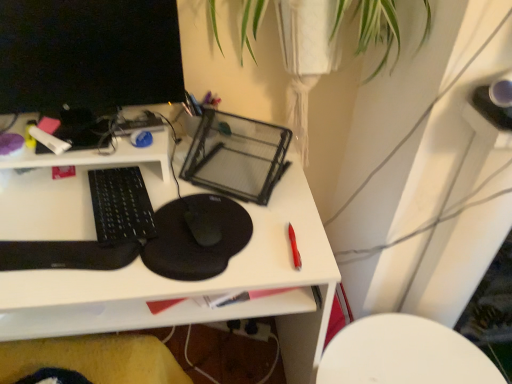
Question: Is black matte mouse at center wider or thinner than black matte mousepad at center?

Choices:
 (A) thin
 (B) wide

Answer: (A)

Question: From the image's perspective, is black matte mouse at center above or below black matte mousepad at center?

Choices:
 (A) above
 (B) below

Answer: (A)

Question: Which object is positioned farthest from the black glossy computer monitor at upper left?

Choices:
 (A) white matte marker at upper left, the 1th stationery when ordered from left to right
 (B) black matte mousepad at center
 (C) red plastic pen at right, the 2th stationery viewed from the left
 (D) black matte mouse at center
 (E) white plastic chair at lower right

Answer: (E)

Question: Which object is the closest to the black glossy computer monitor at upper left?

Choices:
 (A) white matte marker at upper left, the second stationery from the front
 (B) black matte mouse at center
 (C) white plastic chair at lower right
 (D) red plastic pen at right, which appears as the 1th stationery when viewed from the right
 (E) black matte mousepad at center

Answer: (A)